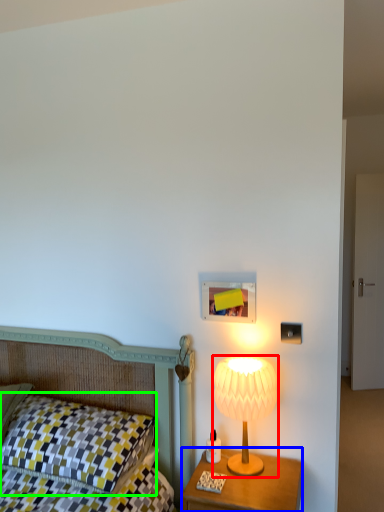
Question: Which object is the closest to the lamp (highlighted by a red box)? Choose among these: nightstand (highlighted by a blue box) or pillow (highlighted by a green box).

Choices:
 (A) nightstand
 (B) pillow

Answer: (A)